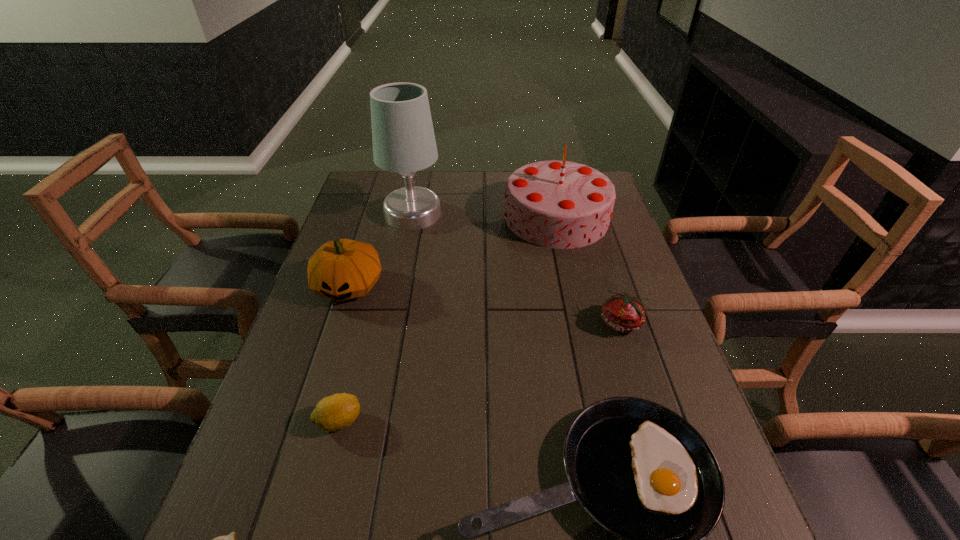
Find the location of `vacant space situated 0.240m at the stem end of the taller lemon`. vacant space situated 0.240m at the stem end of the taller lemon is located at coordinates (480, 421).

I want to click on lampshade positioned at the far edge, so click(x=403, y=137).

I want to click on birthday cake located in the far edge section of the desktop, so click(x=557, y=204).

Image resolution: width=960 pixels, height=540 pixels. Identify the location of lampshade at the left edge. (403, 137).

This screenshot has width=960, height=540. Find the location of `gourd that is at the left edge`. gourd that is at the left edge is located at coordinates (342, 269).

Where is `lemon located at the left edge`? lemon located at the left edge is located at coordinates (335, 412).

At what (x,y) coordinates should I click in order to perform the action: click on birthday cake at the right edge. Please return your answer as a coordinate pair (x, y). Looking at the image, I should click on (557, 204).

Identify the location of tomato at the right edge. (622, 312).

Locate an element on the screen. This screenshot has width=960, height=540. object that is positioned at the far left corner is located at coordinates (403, 137).

At what (x,y) coordinates should I click in order to perform the action: click on object that is at the far right corner. Please return your answer as a coordinate pair (x, y). Image resolution: width=960 pixels, height=540 pixels. Looking at the image, I should click on (557, 204).